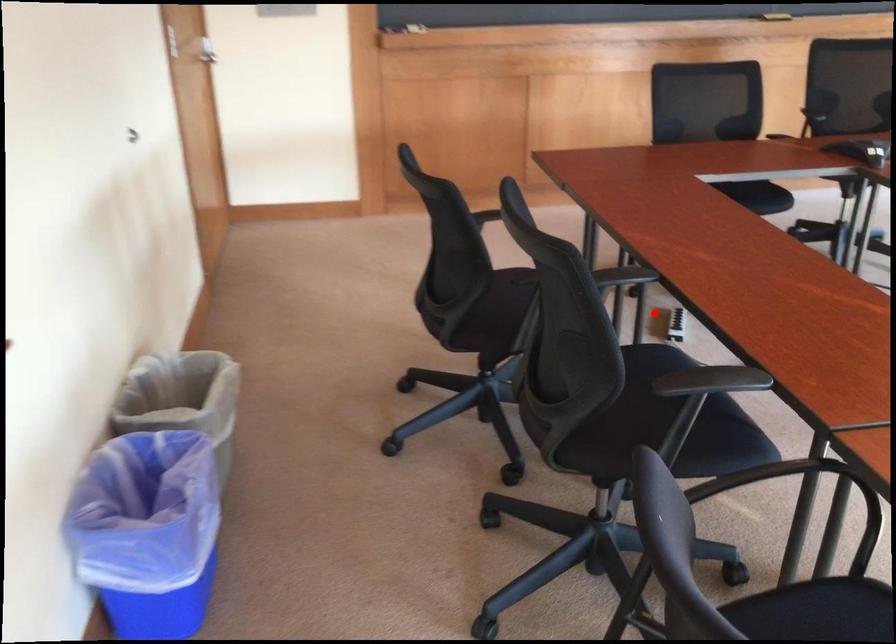
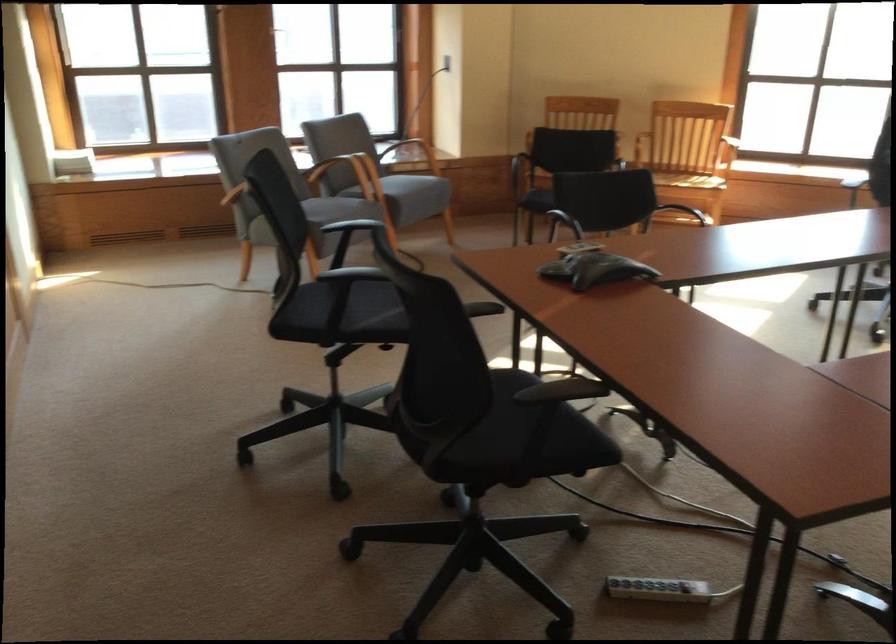
Question: I am providing you with two images of the same scene from different viewpoints. A red point is shown in image1. For the corresponding object point in image2, is it positioned nearer or farther from the camera?

Choices:
 (A) Nearer
 (B) Farther

Answer: (A)